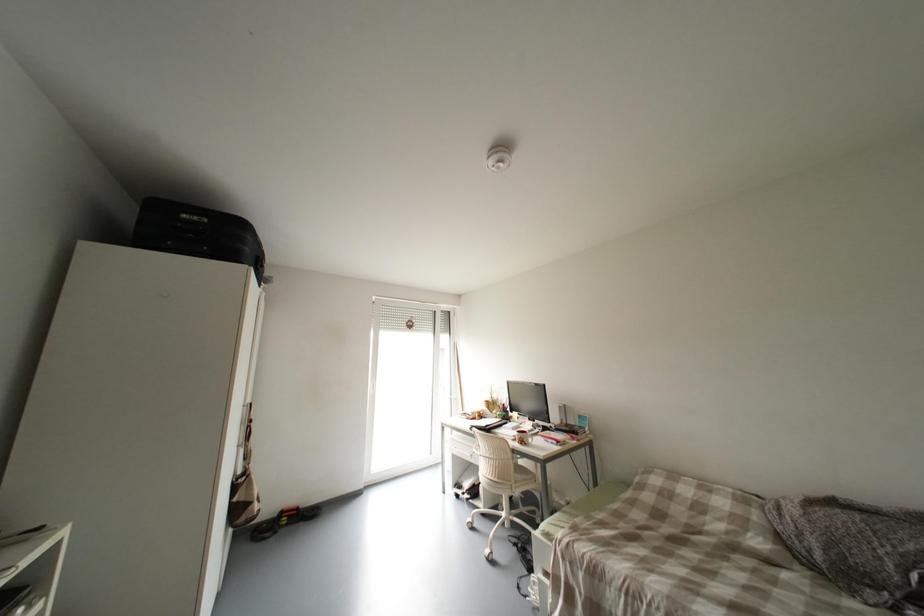
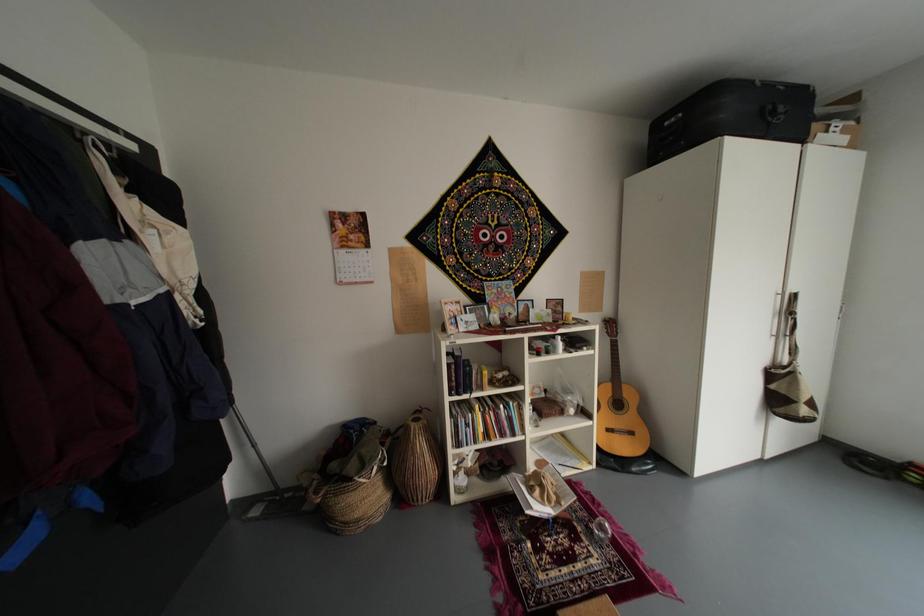
Question: Based on the continuous images, in which direction is the camera rotating? Reply with the corresponding letter.

Choices:
 (A) Left
 (B) Right
 (C) Up
 (D) Down

Answer: (A)